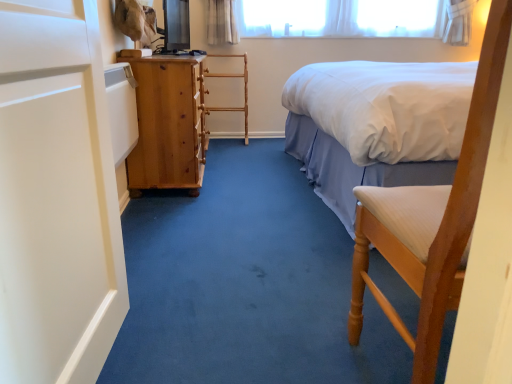
This screenshot has width=512, height=384. What do you see at coordinates (438, 219) in the screenshot?
I see `wooden chair at right` at bounding box center [438, 219].

Measure the distance between white cotton bed at upper right and camera.

1.59 meters.

This screenshot has height=384, width=512. What are the coordinates of `wooden chair at right` in the screenshot? It's located at tap(438, 219).

Can you tell me how much wooden rack at center and white cotton bed at upper right differ in facing direction?

88.6 degrees separate the facing orientations of wooden rack at center and white cotton bed at upper right.

In terms of height, does wooden rack at center look taller or shorter compared to white cotton bed at upper right?

Considering their sizes, wooden rack at center has less height than white cotton bed at upper right.

Which object is thinner, wooden rack at center or white cotton bed at upper right?

wooden rack at center is thinner.

From the image's perspective, is wooden rack at center above or below white cotton bed at upper right?

wooden rack at center is above white cotton bed at upper right.

Considering the sizes of objects wooden chair at right and white matte screen door at left in the image provided, who is taller, wooden chair at right or white matte screen door at left?

Standing taller between the two is wooden chair at right.

From the image's perspective, which one is positioned higher, wooden chair at right or white matte screen door at left?

From the image's view, white matte screen door at left is above.

From a real-world perspective, is wooden chair at right under white matte screen door at left?

Yes, from a real-world perspective, wooden chair at right is beneath white matte screen door at left.

Considering the sizes of objects natural wood chest of drawers at left and white cotton bed at upper right in the image provided, who is bigger, natural wood chest of drawers at left or white cotton bed at upper right?

Bigger between the two is white cotton bed at upper right.

Which is nearer, (132, 171) or (380, 138)?

Point (132, 171) is farther from the camera than point (380, 138).

Is natural wood chest of drawers at left not within white cotton bed at upper right?

Yes, natural wood chest of drawers at left is located beyond the bounds of white cotton bed at upper right.

This screenshot has height=384, width=512. What are the coordinates of `bed in front of the natural wood chest of drawers at left` in the screenshot? It's located at click(x=376, y=125).

From the picture: Would you consider white matte screen door at left to be distant from white cotton bed at upper right?

Absolutely, white matte screen door at left is distant from white cotton bed at upper right.

Considering the relative sizes of white matte screen door at left and white cotton bed at upper right in the image provided, is white matte screen door at left thinner than white cotton bed at upper right?

Indeed, white matte screen door at left has a lesser width compared to white cotton bed at upper right.

Locate an element on the screen. Image resolution: width=512 pixels, height=384 pixels. bed on the right of the white matte screen door at left is located at coordinates (376, 125).

From the image's perspective, who appears lower, white matte screen door at left or white cotton bed at upper right?

white matte screen door at left is shown below in the image.

You are a GUI agent. You are given a task and a screenshot of the screen. Output one action in this format:
    pyautogui.click(x=<x>, y=<y>)
    Task: Click on the chest of drawers below the white cotton bed at upper right (from a real-world perspective)
    
    Given the screenshot: What is the action you would take?
    pyautogui.click(x=167, y=124)

Does white cotton bed at upper right have a greater height compared to natural wood chest of drawers at left?

Yes.

Considering the points (379, 180) and (132, 182), which point is behind, point (379, 180) or point (132, 182)?

Point (132, 182)

Is white cotton bed at upper right positioned before natural wood chest of drawers at left?

That is True.

Is wooden rack at center shorter than white matte screen door at left?

Yes, wooden rack at center is shorter than white matte screen door at left.

Is point (247, 73) more distant than point (119, 277)?

Yes, it is.

Identify the location of armchair behind the white matte screen door at left. (244, 89).

Considering the positions of objects white cotton bed at upper right and white matte screen door at left in the image provided, who is more to the left, white cotton bed at upper right or white matte screen door at left?

From the viewer's perspective, white matte screen door at left appears more on the left side.

Which of these two, white cotton bed at upper right or white matte screen door at left, stands taller?

white cotton bed at upper right.

Does white cotton bed at upper right have a smaller size compared to white matte screen door at left?

Incorrect, white cotton bed at upper right is not smaller in size than white matte screen door at left.

From the image's perspective, is white cotton bed at upper right beneath white matte screen door at left?

Actually, white cotton bed at upper right appears above white matte screen door at left in the image.

Where is `bed that appears on the right of wooden rack at center`? bed that appears on the right of wooden rack at center is located at coordinates (376, 125).

Locate an element on the screen. The image size is (512, 384). chair lying below the white matte screen door at left (from the image's perspective) is located at coordinates (438, 219).

Based on their spatial positions, is white cotton bed at upper right or wooden rack at center closer to wooden chair at right?

white cotton bed at upper right lies closer to wooden chair at right than the other object.

Considering their positions, is wooden chair at right positioned closer to white cotton bed at upper right than white matte screen door at left?

wooden chair at right.

Looking at the image, which one is located further to white cotton bed at upper right, wooden rack at center or natural wood chest of drawers at left?

wooden rack at center lies further to white cotton bed at upper right than the other object.

When comparing their distances from white cotton bed at upper right, does wooden chair at right or natural wood chest of drawers at left seem closer?

Among the two, natural wood chest of drawers at left is located nearer to white cotton bed at upper right.

Considering their positions, is wooden chair at right positioned further to white cotton bed at upper right than wooden rack at center?

Based on the image, wooden rack at center appears to be further to white cotton bed at upper right.

Estimate the real-world distances between objects in this image. Which object is further from natural wood chest of drawers at left, white cotton bed at upper right or wooden chair at right?

wooden chair at right is positioned further to the anchor natural wood chest of drawers at left.

When comparing their distances from white cotton bed at upper right, does white matte screen door at left or natural wood chest of drawers at left seem further?

white matte screen door at left is further to white cotton bed at upper right.

Looking at the image, which one is located further to white matte screen door at left, natural wood chest of drawers at left or wooden chair at right?

natural wood chest of drawers at left is further to white matte screen door at left.

This screenshot has height=384, width=512. I want to click on bed between white matte screen door at left and wooden rack at center along the z-axis, so click(376, 125).

The width and height of the screenshot is (512, 384). Find the location of `screen door situated between natural wood chest of drawers at left and white cotton bed at upper right from left to right`. screen door situated between natural wood chest of drawers at left and white cotton bed at upper right from left to right is located at coordinates (56, 197).

Where is `chest of drawers between white matte screen door at left and wooden rack at center along the z-axis`? The width and height of the screenshot is (512, 384). chest of drawers between white matte screen door at left and wooden rack at center along the z-axis is located at coordinates (167, 124).

The width and height of the screenshot is (512, 384). I want to click on chair located between natural wood chest of drawers at left and white cotton bed at upper right in the left-right direction, so click(x=438, y=219).